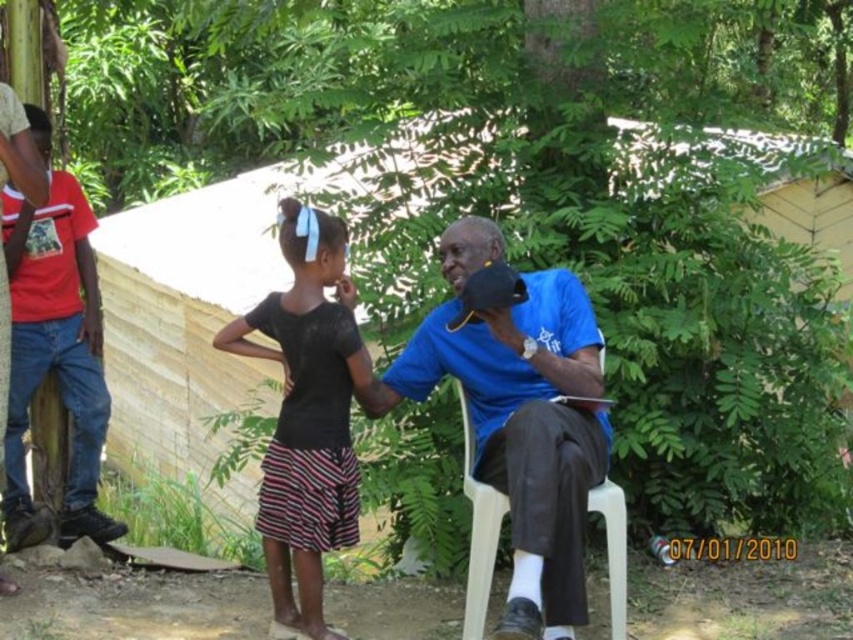
Who is more forward, (573, 618) or (474, 572)?

Point (573, 618)

Where is `blue fabric shirt at center`? blue fabric shirt at center is located at coordinates (523, 432).

Can you confirm if wooden fence at center is positioned above blue fabric shirt at center?

Correct, wooden fence at center is located above blue fabric shirt at center.

Image resolution: width=853 pixels, height=640 pixels. I want to click on wooden fence at center, so click(192, 320).

This screenshot has width=853, height=640. Identify the location of wooden fence at center. (192, 320).

Between blue fabric shirt at center and black mesh shirt at center, which one has more height?

With more height is black mesh shirt at center.

Is blue fabric shirt at center smaller than black mesh shirt at center?

Actually, blue fabric shirt at center might be larger than black mesh shirt at center.

Where is `blue fabric shirt at center`? This screenshot has width=853, height=640. blue fabric shirt at center is located at coordinates (523, 432).